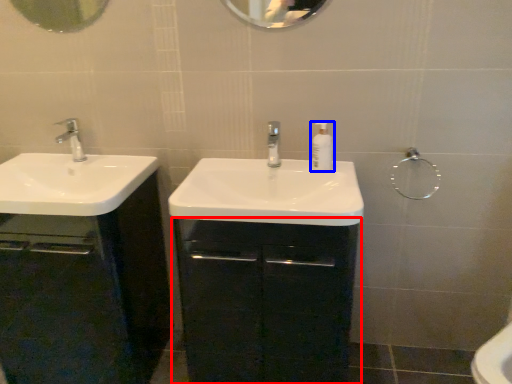
Question: Which of the following is the closest to the observer, bathroom cabinet (highlighted by a red box) or soap dispenser (highlighted by a blue box)?

Choices:
 (A) bathroom cabinet
 (B) soap dispenser

Answer: (A)